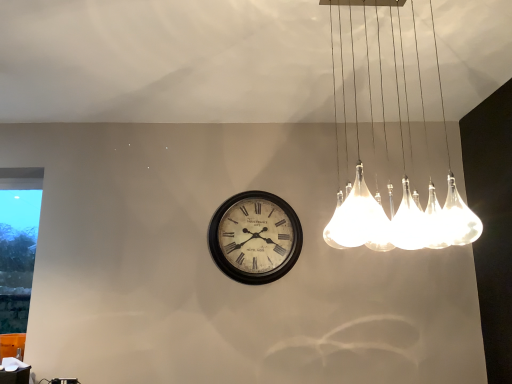
Question: Is vintage white clock at center at the left side of white matte table at lower left?

Choices:
 (A) yes
 (B) no

Answer: (B)

Question: From the image's perspective, does vintage white clock at center appear lower than white matte table at lower left?

Choices:
 (A) yes
 (B) no

Answer: (B)

Question: Does vintage white clock at center have a smaller size compared to white matte table at lower left?

Choices:
 (A) no
 (B) yes

Answer: (A)

Question: Is white matte table at lower left completely or partially inside vintage white clock at center?

Choices:
 (A) no
 (B) yes

Answer: (A)

Question: From the image's perspective, does vintage white clock at center appear higher than white matte table at lower left?

Choices:
 (A) no
 (B) yes

Answer: (B)

Question: Considering their positions, is white matte table at lower left located in front of or behind transparent glass window at left?

Choices:
 (A) behind
 (B) front

Answer: (B)

Question: Considering the positions of white matte table at lower left and transparent glass window at left in the image, is white matte table at lower left wider or thinner than transparent glass window at left?

Choices:
 (A) thin
 (B) wide

Answer: (B)

Question: Is white matte table at lower left bigger or smaller than transparent glass window at left?

Choices:
 (A) small
 (B) big

Answer: (A)

Question: Is white matte table at lower left taller or shorter than transparent glass window at left?

Choices:
 (A) tall
 (B) short

Answer: (B)

Question: Based on their sizes in the image, would you say clear glass pendant lights at upper right is bigger or smaller than white matte table at lower left?

Choices:
 (A) big
 (B) small

Answer: (A)

Question: Is point (462, 241) closer or farther from the camera than point (6, 367)?

Choices:
 (A) farther
 (B) closer

Answer: (A)

Question: Is clear glass pendant lights at upper right wider or thinner than white matte table at lower left?

Choices:
 (A) wide
 (B) thin

Answer: (A)

Question: From the image's perspective, is clear glass pendant lights at upper right above or below white matte table at lower left?

Choices:
 (A) below
 (B) above

Answer: (B)

Question: Is point (220, 231) closer or farther from the camera than point (1, 322)?

Choices:
 (A) farther
 (B) closer

Answer: (B)

Question: Is vintage white clock at center wider or thinner than transparent glass window at left?

Choices:
 (A) wide
 (B) thin

Answer: (A)